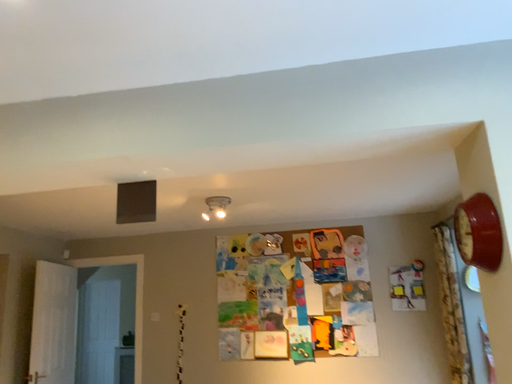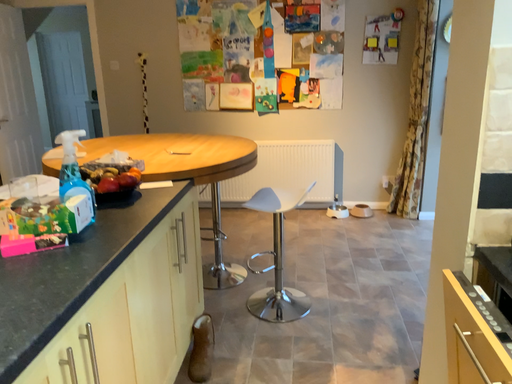
Question: How did the camera likely rotate when shooting the video?

Choices:
 (A) rotated downward
 (B) rotated upward

Answer: (A)